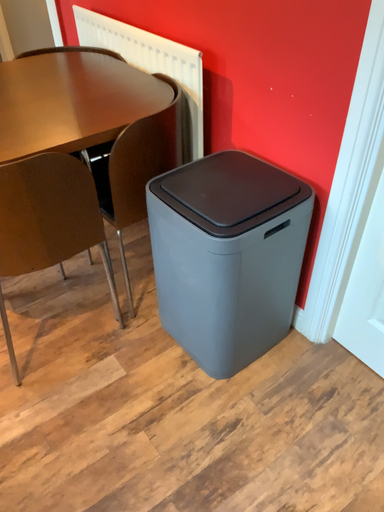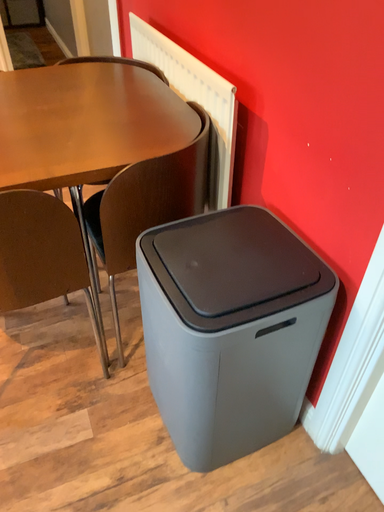
Question: Which way did the camera rotate in the video?

Choices:
 (A) rotated left
 (B) rotated right

Answer: (A)